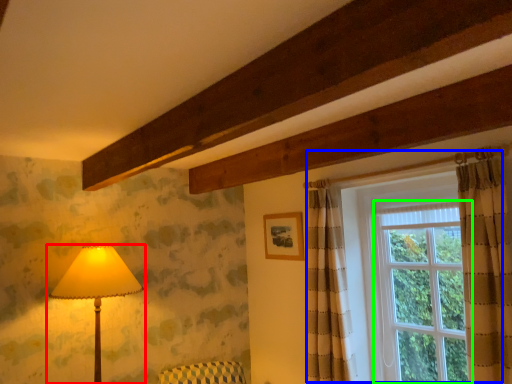
Question: Which is nearer to the lamp (highlighted by a red box)? window (highlighted by a blue box) or window (highlighted by a green box).

Choices:
 (A) window
 (B) window

Answer: (A)